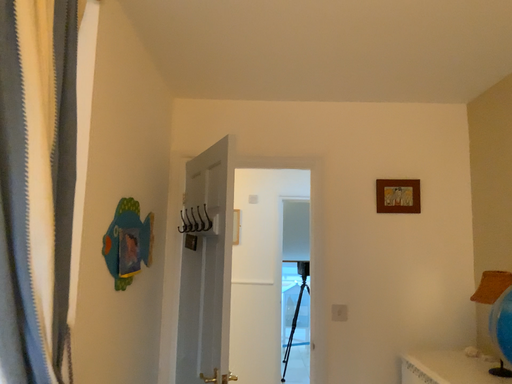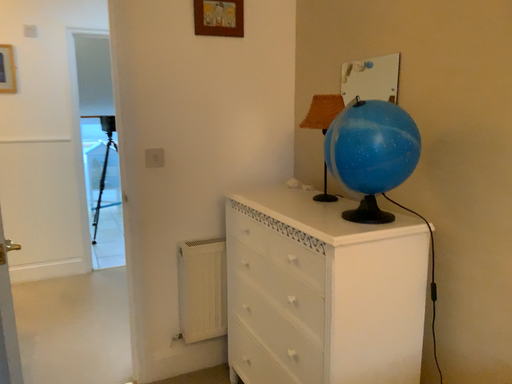
Question: How did the camera likely rotate when shooting the video?

Choices:
 (A) rotated upward
 (B) rotated downward

Answer: (B)